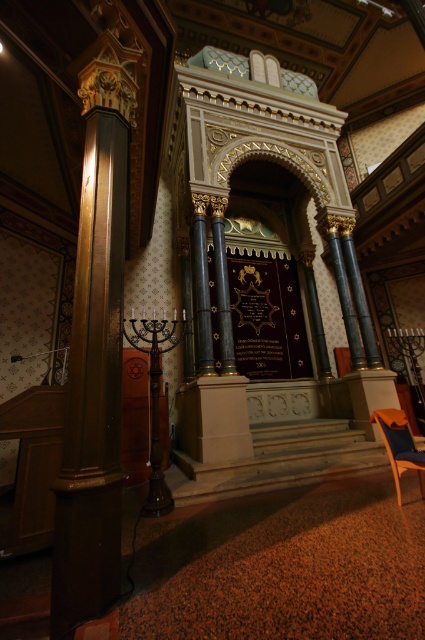
You are an interior designer assessing the synagogue. You need to place a tall decorative statue that requires a minimum height clearance of 2 meters. Based on the dark wood column at left and wooden armchair at lower right, which object can accommodate this requirement?

The dark wood column at left has a greater height compared to the wooden armchair at lower right, so the dark wood column at left can accommodate the 2 meter height requirement.

Based on the photo, you are an interior designer planning to place a new sofa in the synagogue. You have a sofa that is 2 meters wide. The dark wood column at left and wooden armchair at lower right are in the way. Which object do you need to consider more in terms of space when placing the sofa?

The dark wood column at left is bigger than the wooden armchair at lower right, so you need to consider the dark wood column at left more in terms of space when placing the sofa.